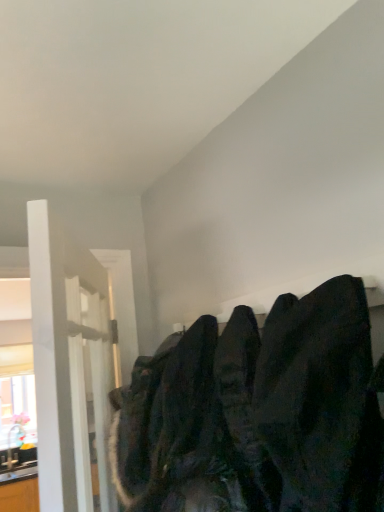
In order to face white glossy door at left, should I rotate leftwards or rightwards?

To face it directly, rotate left by 13.461 degrees.

Image resolution: width=384 pixels, height=512 pixels. What do you see at coordinates (69, 364) in the screenshot? I see `white glossy door at left` at bounding box center [69, 364].

What do you see at coordinates (320, 399) in the screenshot? I see `dark fabric coat at upper right` at bounding box center [320, 399].

The image size is (384, 512). Find the location of `white glossy door at left`. white glossy door at left is located at coordinates [x=69, y=364].

Identify the location of door behind the dark matte sweatshirt at upper right. (69, 364).

Can you confirm if dark matte sweatshirt at upper right is smaller than white glossy door at left?

Yes.

Consider the image. What's the angular difference between dark matte sweatshirt at upper right and white glossy door at left's facing directions?

31.6 degrees.

Which is in front, point (251, 474) or point (36, 223)?

The point (36, 223) is closer to the camera.

Is point (302, 503) closer or farther from the camera than point (29, 379)?

Point (302, 503).

Consider the image. Are dark matte sweatshirt at upper right and matte white window at left far apart?

Indeed, dark matte sweatshirt at upper right is not near matte white window at left.

From the image's perspective, which one is positioned lower, dark matte sweatshirt at upper right or matte white window at left?

matte white window at left, from the image's perspective.

Is dark matte sweatshirt at upper right looking in the opposite direction of matte white window at left?

No, dark matte sweatshirt at upper right is not facing the opposite direction of matte white window at left.

How distant is matte white window at left from dark fabric coat at upper right?

matte white window at left and dark fabric coat at upper right are 4.18 meters apart from each other.

From a real-world perspective, which is physically below, matte white window at left or dark fabric coat at upper right?

matte white window at left.

Consider the image. Considering the relative sizes of matte white window at left and dark fabric coat at upper right in the image provided, is matte white window at left taller than dark fabric coat at upper right?

Correct, matte white window at left is much taller as dark fabric coat at upper right.

Is white glossy door at left far from dark fabric coat at upper right?

No, white glossy door at left is not far away from dark fabric coat at upper right.

Is white glossy door at left shorter than dark fabric coat at upper right?

Incorrect, the height of white glossy door at left does not fall short of that of dark fabric coat at upper right.

From the image's perspective, which is above, white glossy door at left or dark fabric coat at upper right?

dark fabric coat at upper right is shown above in the image.

Considering the positions of points (339, 312) and (282, 480), is point (339, 312) closer to camera compared to point (282, 480)?

No, (339, 312) is further to viewer.

From the image's perspective, which one is positioned lower, dark fabric coat at upper right or dark matte sweatshirt at upper right?

dark matte sweatshirt at upper right.

Looking at the image, does dark fabric coat at upper right seem bigger or smaller compared to dark matte sweatshirt at upper right?

dark fabric coat at upper right is smaller than dark matte sweatshirt at upper right.

Does dark fabric coat at upper right have a greater height compared to dark matte sweatshirt at upper right?

In fact, dark fabric coat at upper right may be shorter than dark matte sweatshirt at upper right.

Can you confirm if dark fabric coat at upper right is bigger than matte white window at left?

No.

Based on the photo, from a real-world perspective, relative to matte white window at left, is dark fabric coat at upper right vertically above or below?

dark fabric coat at upper right is situated higher than matte white window at left in the real world.

Is dark fabric coat at upper right thinner than matte white window at left?

No.

Who is taller, white glossy door at left or dark matte sweatshirt at upper right?

Standing taller between the two is white glossy door at left.

Is white glossy door at left positioned beyond the bounds of dark matte sweatshirt at upper right?

Yes, white glossy door at left is outside of dark matte sweatshirt at upper right.

Can you confirm if white glossy door at left is wider than dark matte sweatshirt at upper right?

No.

At what (x,y) coordinates should I click in order to perform the action: click on door located on the left of dark matte sweatshirt at upper right. Please return your answer as a coordinate pair (x, y). The width and height of the screenshot is (384, 512). Looking at the image, I should click on (69, 364).

The height and width of the screenshot is (512, 384). What are the coordinates of `sweatshirt on the right side of matte white window at left` in the screenshot? It's located at (257, 413).

Based on the photo, when comparing their distances from dark matte sweatshirt at upper right, does white glossy door at left or dark fabric coat at upper right seem further?

Among the two, white glossy door at left is located further to dark matte sweatshirt at upper right.

Considering their positions, is white glossy door at left positioned closer to dark matte sweatshirt at upper right than matte white window at left?

white glossy door at left.

Based on their spatial positions, is matte white window at left or dark fabric coat at upper right further from white glossy door at left?

matte white window at left is positioned further to the anchor white glossy door at left.

Looking at the image, which one is located closer to matte white window at left, dark matte sweatshirt at upper right or white glossy door at left?

Among the two, white glossy door at left is located nearer to matte white window at left.

When comparing their distances from dark fabric coat at upper right, does dark matte sweatshirt at upper right or matte white window at left seem closer?

The object closer to dark fabric coat at upper right is dark matte sweatshirt at upper right.

Looking at this image, from the image, which object appears to be farther from dark matte sweatshirt at upper right, matte white window at left or dark fabric coat at upper right?

Based on the image, matte white window at left appears to be further to dark matte sweatshirt at upper right.

Which object lies nearer to the anchor point dark matte sweatshirt at upper right, dark fabric coat at upper right or white glossy door at left?

dark fabric coat at upper right is positioned closer to the anchor dark matte sweatshirt at upper right.

From the image, which object appears to be farther from white glossy door at left, dark matte sweatshirt at upper right or dark fabric coat at upper right?

Among the two, dark fabric coat at upper right is located further to white glossy door at left.

You are a GUI agent. You are given a task and a screenshot of the screen. Output one action in this format:
    pyautogui.click(x=<x>, y=<y>)
    Task: Click on the door between dark matte sweatshirt at upper right and matte white window at left along the z-axis
    The width and height of the screenshot is (384, 512).
    Given the screenshot: What is the action you would take?
    [69, 364]

Where is `sweatshirt between white glossy door at left and dark fabric coat at upper right`? Image resolution: width=384 pixels, height=512 pixels. sweatshirt between white glossy door at left and dark fabric coat at upper right is located at coordinates (257, 413).

Find the location of a particular element. sweatshirt between dark fabric coat at upper right and matte white window at left from front to back is located at coordinates (257, 413).

Image resolution: width=384 pixels, height=512 pixels. I want to click on door between dark fabric coat at upper right and matte white window at left from front to back, so click(x=69, y=364).